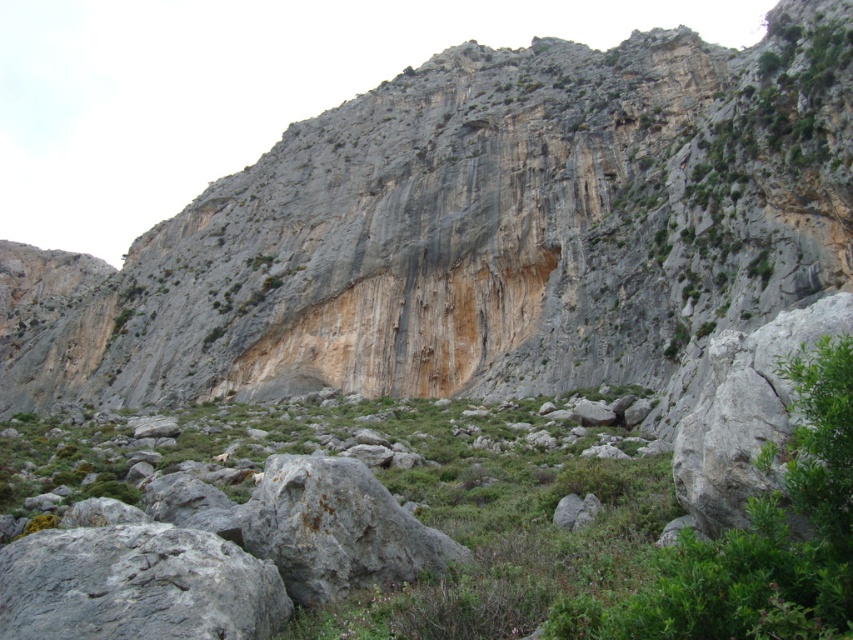
Question: Among these objects, which one is nearest to the camera?

Choices:
 (A) green leafy bush at center
 (B) gray rock formation at center

Answer: (A)

Question: Does green leafy bush at center appear under gray rough rock at lower left?

Choices:
 (A) yes
 (B) no

Answer: (B)

Question: Which of the following is the closest to the observer?

Choices:
 (A) (131, 536)
 (B) (851, 531)

Answer: (B)

Question: Which is farther from the green leafy bush at center?

Choices:
 (A) gray rock formation at center
 (B) gray rough rock at lower left

Answer: (A)

Question: Does gray rock formation at center have a larger size compared to green leafy bush at center?

Choices:
 (A) yes
 (B) no

Answer: (A)

Question: Does green leafy bush at center lie in front of gray rough rock at lower left?

Choices:
 (A) yes
 (B) no

Answer: (A)